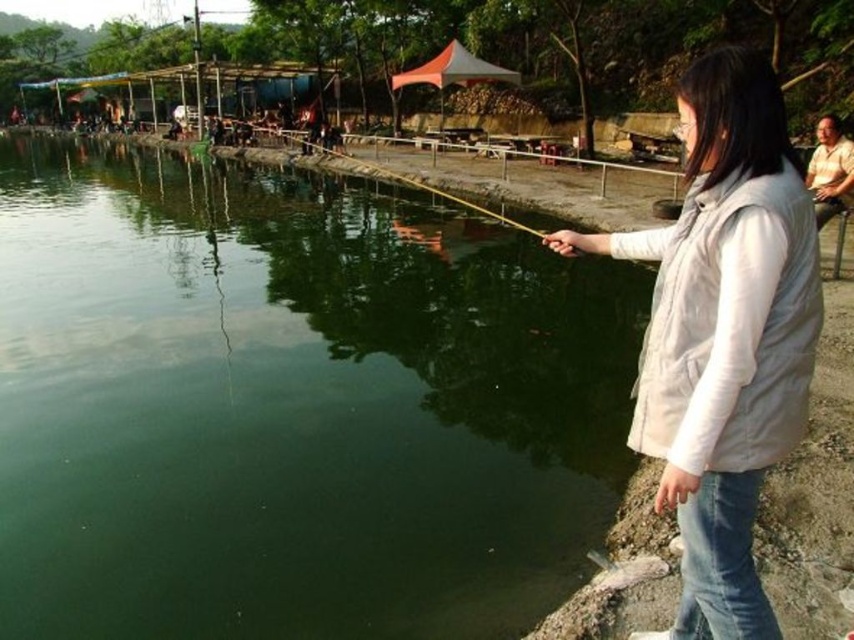
Does green smooth water at center come in front of white matte vest at right?

No, it is behind white matte vest at right.

Is point (86, 502) positioned after point (683, 502)?

Yes, point (86, 502) is behind point (683, 502).

You are a GUI agent. You are given a task and a screenshot of the screen. Output one action in this format:
    pyautogui.click(x=<x>, y=<y>)
    Task: Click on the green smooth water at center
    This screenshot has height=640, width=854.
    Given the screenshot: What is the action you would take?
    pyautogui.click(x=291, y=404)